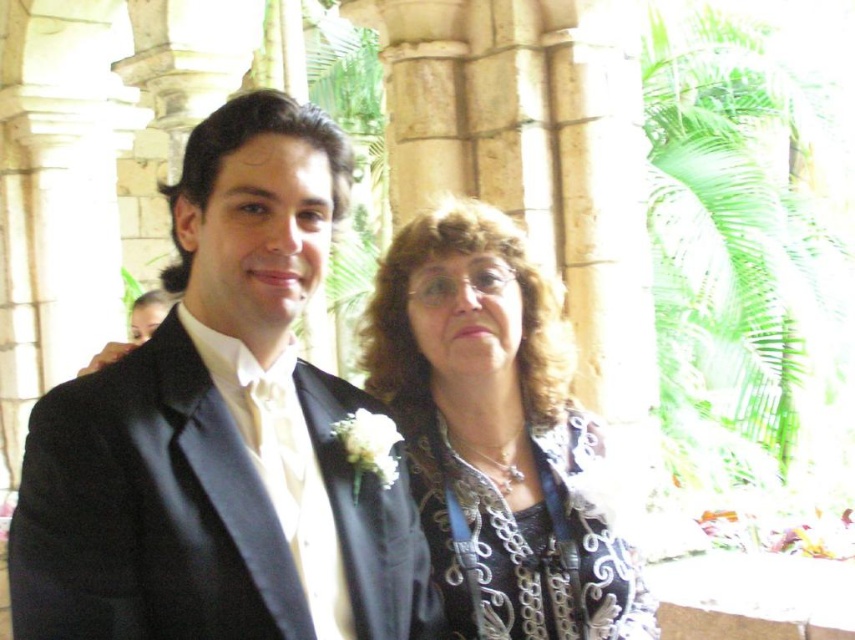
In the scene shown: You are a photographer setting up for a group photo. You see the silver embroidered jacket at center and the silver metallic dress at center. Which one should you focus on first if you want to capture the larger object in the frame?

The silver embroidered jacket at center is larger in size than the silver metallic dress at center, so you should focus on the silver embroidered jacket at center first to capture the larger object in the frame.

Based on the photo, you are a photographer positioned to the side of the two people in the image. You want to capture a photo where the satin black suit at center is clearly visible without being blocked by the silver embroidered jacket at center. Based on their positions, is this possible?

The satin black suit at center is above the silver embroidered jacket at center, so yes, the photographer can capture the satin black suit at center without obstruction since it is positioned higher.